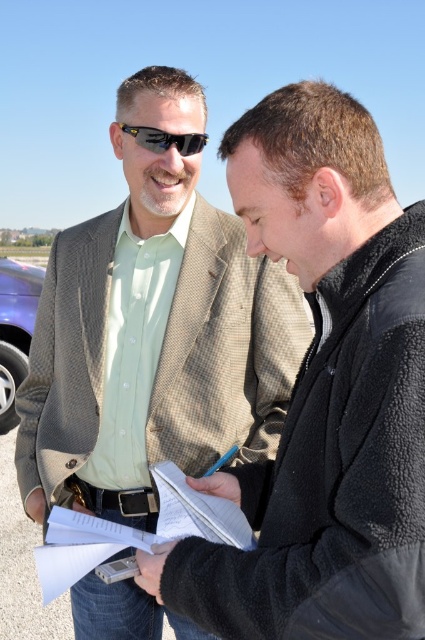
Is point (320, 428) closer to camera compared to point (175, 365)?

That is True.

Between point (269, 496) and point (22, 476), which one is positioned behind?

The point (22, 476) is more distant.

This screenshot has height=640, width=425. In order to click on light brown textured blazer at center in this screenshot , I will do `click(323, 394)`.

Locate an element on the screen. The height and width of the screenshot is (640, 425). light brown textured blazer at center is located at coordinates (323, 394).

Does white paper at center have a greater height compared to black plastic sunglasses at upper center?

Indeed, white paper at center has a greater height compared to black plastic sunglasses at upper center.

Based on the photo, how far apart are white paper at center and black plastic sunglasses at upper center?

white paper at center is 3.99 feet from black plastic sunglasses at upper center.

This screenshot has width=425, height=640. Describe the element at coordinates (197, 512) in the screenshot. I see `white paper at center` at that location.

This screenshot has width=425, height=640. What are the coordinates of `white paper at center` in the screenshot? It's located at (197, 512).

Which of these two, light brown textured blazer at center or white paper at center, stands taller?

light brown textured blazer at center

Consider the image. Who is higher up, light brown textured blazer at center or white paper at center?

Positioned higher is light brown textured blazer at center.

Does point (167, 602) lie in front of point (207, 518)?

Yes.

You are a GUI agent. You are given a task and a screenshot of the screen. Output one action in this format:
    pyautogui.click(x=<x>, y=<y>)
    Task: Click on the light brown textured blazer at center
    This screenshot has height=640, width=425.
    Given the screenshot: What is the action you would take?
    pyautogui.click(x=323, y=394)